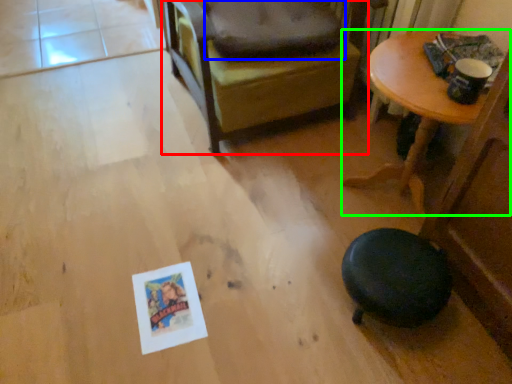
Question: Which is farther away from chair (highlighted by a red box)? dog bed (highlighted by a blue box) or table (highlighted by a green box)?

Choices:
 (A) dog bed
 (B) table

Answer: (B)